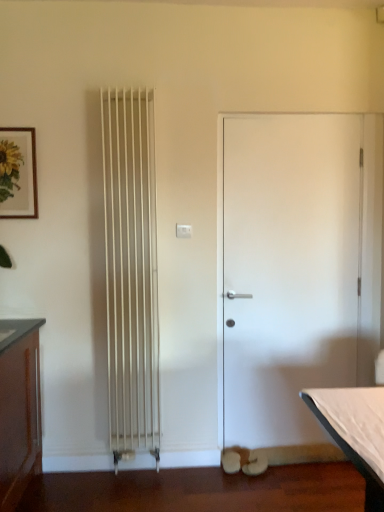
At what (x,y) coordinates should I click in order to perform the action: click on free location in front of white matte door at center. Please return your answer as a coordinate pair (x, y). Looking at the image, I should click on (307, 492).